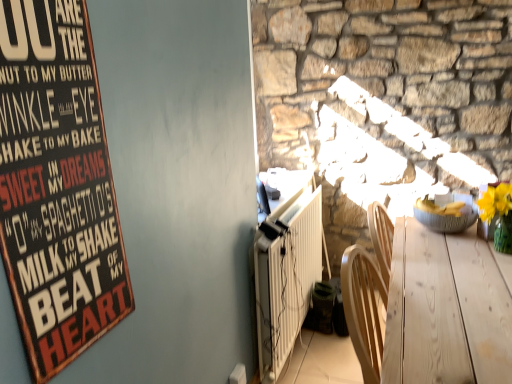
Question: From the image's perspective, is matte gray bowl at right below wooden signboard at upper left?

Choices:
 (A) no
 (B) yes

Answer: (B)

Question: From a real-world perspective, is matte gray bowl at right beneath wooden signboard at upper left?

Choices:
 (A) no
 (B) yes

Answer: (B)

Question: From the image's perspective, is matte gray bowl at right on top of wooden signboard at upper left?

Choices:
 (A) yes
 (B) no

Answer: (B)

Question: Is there a large distance between matte gray bowl at right and wooden signboard at upper left?

Choices:
 (A) yes
 (B) no

Answer: (A)

Question: Is matte gray bowl at right to the right of wooden signboard at upper left from the viewer's perspective?

Choices:
 (A) yes
 (B) no

Answer: (A)

Question: Considering the relative positions of matte gray bowl at right and wooden signboard at upper left in the image provided, is matte gray bowl at right to the left of wooden signboard at upper left from the viewer's perspective?

Choices:
 (A) yes
 (B) no

Answer: (B)

Question: Considering the relative positions of white textured radiator at lower center and wooden signboard at upper left in the image provided, is white textured radiator at lower center to the right of wooden signboard at upper left from the viewer's perspective?

Choices:
 (A) yes
 (B) no

Answer: (A)

Question: Is white textured radiator at lower center facing away from wooden signboard at upper left?

Choices:
 (A) yes
 (B) no

Answer: (B)

Question: Considering the relative positions of white textured radiator at lower center and wooden signboard at upper left in the image provided, is white textured radiator at lower center to the left of wooden signboard at upper left from the viewer's perspective?

Choices:
 (A) yes
 (B) no

Answer: (B)

Question: Is white textured radiator at lower center wider than wooden signboard at upper left?

Choices:
 (A) no
 (B) yes

Answer: (B)

Question: Is white textured radiator at lower center facing towards wooden signboard at upper left?

Choices:
 (A) yes
 (B) no

Answer: (B)

Question: From a real-world perspective, does white textured radiator at lower center sit lower than wooden signboard at upper left?

Choices:
 (A) no
 (B) yes

Answer: (B)

Question: Does white textured radiator at lower center come in front of light wood table at lower right?

Choices:
 (A) no
 (B) yes

Answer: (A)